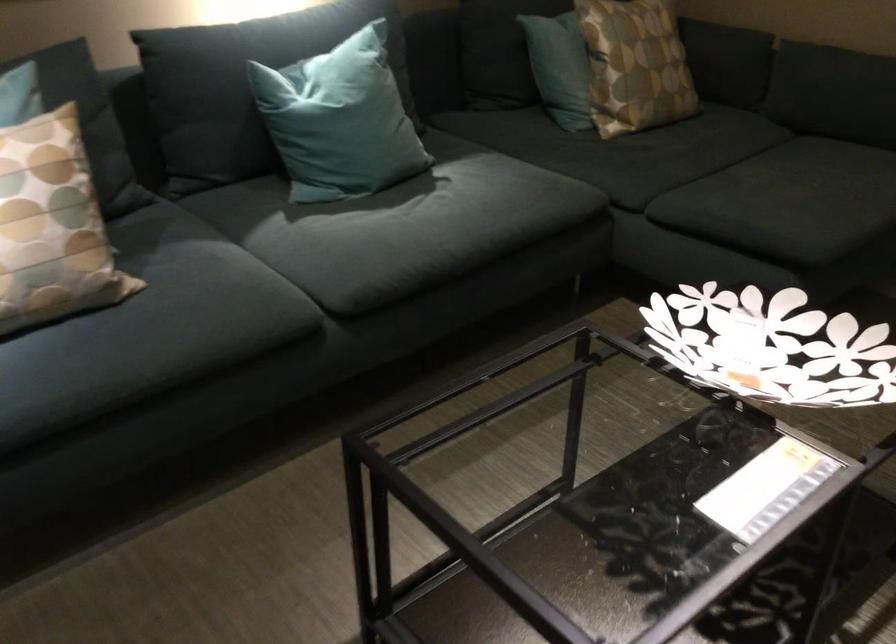
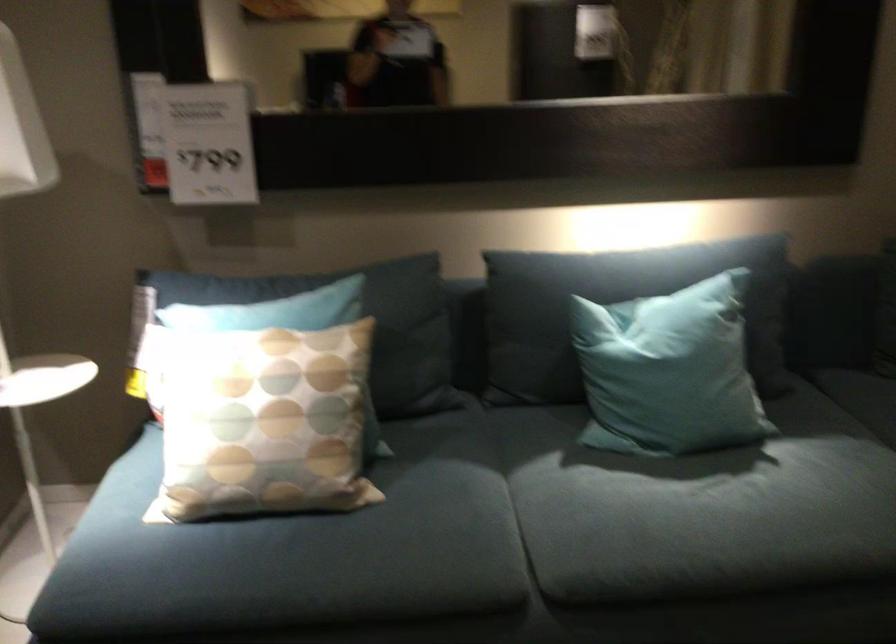
Find the pixel in the second image that matches point (358, 118) in the first image.

(668, 371)